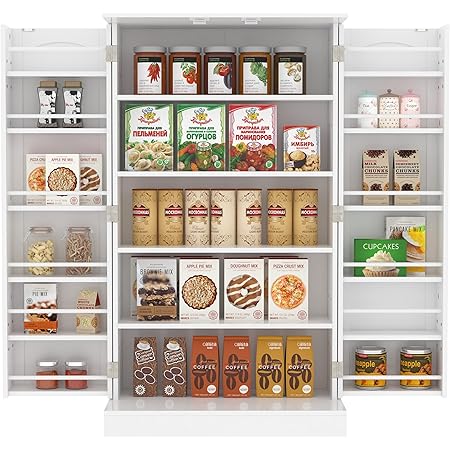
What are the coordinates of `jars` in the screenshot? It's located at (40, 241), (74, 243), (46, 370), (80, 370), (51, 95), (72, 96), (151, 76), (216, 81), (252, 78), (286, 76).